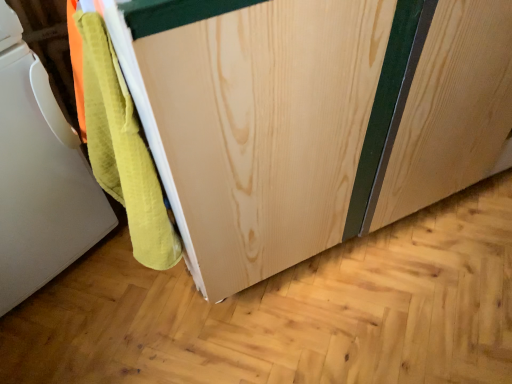
Question: Visually, is natural wood cabinet at center positioned to the left or to the right of white matte towel at lower left?

Choices:
 (A) left
 (B) right

Answer: (B)

Question: From a real-world perspective, is natural wood cabinet at center physically located above or below white matte towel at lower left?

Choices:
 (A) above
 (B) below

Answer: (B)

Question: Based on their sizes in the image, would you say natural wood cabinet at center is bigger or smaller than white matte towel at lower left?

Choices:
 (A) small
 (B) big

Answer: (B)

Question: In the image, is white matte towel at lower left positioned in front of or behind natural wood cabinet at center?

Choices:
 (A) behind
 (B) front

Answer: (A)

Question: Choose the correct answer: Is white matte towel at lower left inside natural wood cabinet at center or outside it?

Choices:
 (A) outside
 (B) inside

Answer: (A)

Question: From a real-world perspective, is white matte towel at lower left positioned above or below natural wood cabinet at center?

Choices:
 (A) above
 (B) below

Answer: (A)

Question: Looking at the image, does white matte towel at lower left seem bigger or smaller compared to natural wood cabinet at center?

Choices:
 (A) big
 (B) small

Answer: (B)